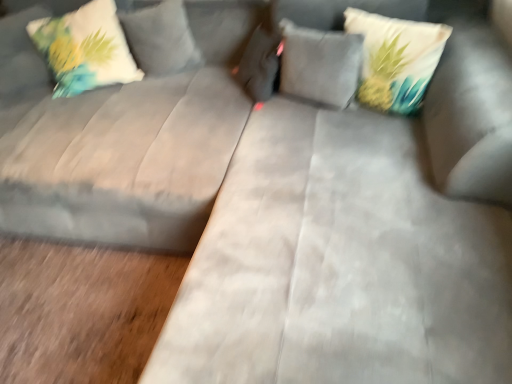
Identify the location of suede gray couch at center. The height and width of the screenshot is (384, 512). (113, 152).

Identify the location of suede gray pillow at center, the second pillow from the left. This screenshot has height=384, width=512. (320, 64).

What are the coordinates of `printed fabric pillow at upper right, which is the 1th pillow in right-to-left order` in the screenshot? It's located at (396, 59).

Where is `white fabric pillow with floral design at upper left, positioned as the third pillow in right-to-left order`? This screenshot has width=512, height=384. white fabric pillow with floral design at upper left, positioned as the third pillow in right-to-left order is located at coordinates (85, 48).

Can you confirm if suede gray couch at center is wider than white fabric pillow with floral design at upper left, the 1th pillow positioned from the left?

Yes, suede gray couch at center is wider than white fabric pillow with floral design at upper left, the 1th pillow positioned from the left.

Is suede gray couch at center touching white fabric pillow with floral design at upper left, the 1th pillow positioned from the left?

No, suede gray couch at center is not beside white fabric pillow with floral design at upper left, the 1th pillow positioned from the left.

Does point (47, 221) lie in front of point (61, 51)?

Yes, it is.

From the picture: From a real-world perspective, is suede gray couch at center beneath white fabric pillow with floral design at upper left, positioned as the third pillow in right-to-left order?

Yes, from a real-world perspective, suede gray couch at center is beneath white fabric pillow with floral design at upper left, positioned as the third pillow in right-to-left order.

Is white fabric pillow with floral design at upper left, the 1th pillow positioned from the left, facing towards printed fabric pillow at upper right, which is the 1th pillow in right-to-left order?

No, white fabric pillow with floral design at upper left, the 1th pillow positioned from the left, does not turn towards printed fabric pillow at upper right, which is the 1th pillow in right-to-left order.

Which point is more forward, [111,68] or [374,97]?

Positioned in front is point [374,97].

Does white fabric pillow with floral design at upper left, positioned as the third pillow in right-to-left order, have a smaller size compared to printed fabric pillow at upper right, the third pillow in the left-to-right sequence?

Incorrect, white fabric pillow with floral design at upper left, positioned as the third pillow in right-to-left order, is not smaller in size than printed fabric pillow at upper right, the third pillow in the left-to-right sequence.

From a real-world perspective, is white fabric pillow with floral design at upper left, the 1th pillow positioned from the left, positioned under printed fabric pillow at upper right, which is the 1th pillow in right-to-left order, based on gravity?

No, from a real-world perspective, white fabric pillow with floral design at upper left, the 1th pillow positioned from the left, is not under printed fabric pillow at upper right, which is the 1th pillow in right-to-left order.

Which is closer, (x=93, y=71) or (x=217, y=107)?

The point (x=217, y=107) is more forward.

From their relative heights in the image, would you say white fabric pillow with floral design at upper left, positioned as the third pillow in right-to-left order, is taller or shorter than suede gray couch at center?

white fabric pillow with floral design at upper left, positioned as the third pillow in right-to-left order, is shorter than suede gray couch at center.

Is white fabric pillow with floral design at upper left, positioned as the third pillow in right-to-left order, completely or partially outside of suede gray couch at center?

Actually, white fabric pillow with floral design at upper left, positioned as the third pillow in right-to-left order, is at least partially inside suede gray couch at center.

Can you tell me how much white fabric pillow with floral design at upper left, positioned as the third pillow in right-to-left order, and suede gray couch at center differ in facing direction?

0.000248 degrees.

Based on the photo, from a real-world perspective, between printed fabric pillow at upper right, which is the 1th pillow in right-to-left order, and suede gray couch at center, who is vertically higher?

printed fabric pillow at upper right, which is the 1th pillow in right-to-left order, from a real-world perspective.

Which of these two, printed fabric pillow at upper right, the third pillow in the left-to-right sequence, or suede gray couch at center, is bigger?

With larger size is suede gray couch at center.

Is printed fabric pillow at upper right, which is the 1th pillow in right-to-left order, next to suede gray couch at center?

No, printed fabric pillow at upper right, which is the 1th pillow in right-to-left order, is not touching suede gray couch at center.

Is printed fabric pillow at upper right, the third pillow in the left-to-right sequence, aimed at suede gray couch at center?

No, printed fabric pillow at upper right, the third pillow in the left-to-right sequence, is not facing towards suede gray couch at center.

Can suede gray pillow at center, which ranks as the 2th pillow in right-to-left order, be found inside printed fabric pillow at upper right, which is the 1th pillow in right-to-left order?

No.

From a real-world perspective, which is physically below, printed fabric pillow at upper right, the third pillow in the left-to-right sequence, or suede gray pillow at center, which ranks as the 2th pillow in right-to-left order?

From a 3D spatial view, suede gray pillow at center, which ranks as the 2th pillow in right-to-left order, is below.

Considering the relative sizes of printed fabric pillow at upper right, which is the 1th pillow in right-to-left order, and suede gray pillow at center, the second pillow from the left, in the image provided, is printed fabric pillow at upper right, which is the 1th pillow in right-to-left order, smaller than suede gray pillow at center, the second pillow from the left,?

No, printed fabric pillow at upper right, which is the 1th pillow in right-to-left order, is not smaller than suede gray pillow at center, the second pillow from the left.

Looking at their sizes, would you say printed fabric pillow at upper right, the third pillow in the left-to-right sequence, is wider or thinner than suede gray pillow at center, the second pillow from the left?

Considering their sizes, printed fabric pillow at upper right, the third pillow in the left-to-right sequence, looks broader than suede gray pillow at center, the second pillow from the left.

Considering the relative sizes of suede gray couch at center and suede gray pillow at center, which ranks as the 2th pillow in right-to-left order, in the image provided, is suede gray couch at center wider than suede gray pillow at center, which ranks as the 2th pillow in right-to-left order,?

Yes.

Which point is more distant from viewer, (143, 188) or (304, 45)?

Point (304, 45)

Is suede gray couch at center aimed at suede gray pillow at center, the second pillow from the left?

No, suede gray couch at center is not oriented towards suede gray pillow at center, the second pillow from the left.

From the image's perspective, is suede gray couch at center below suede gray pillow at center, which ranks as the 2th pillow in right-to-left order?

Correct, suede gray couch at center appears lower than suede gray pillow at center, which ranks as the 2th pillow in right-to-left order, in the image.

Is suede gray couch at center next to printed fabric pillow at upper right, the third pillow in the left-to-right sequence, and touching it?

No.

Which of these two, suede gray couch at center or printed fabric pillow at upper right, the third pillow in the left-to-right sequence, stands taller?

suede gray couch at center is taller.

From the image's perspective, is suede gray couch at center on top of printed fabric pillow at upper right, which is the 1th pillow in right-to-left order?

No, from the image's perspective, suede gray couch at center is not on top of printed fabric pillow at upper right, which is the 1th pillow in right-to-left order.

This screenshot has width=512, height=384. What are the coordinates of `couch in front of the white fabric pillow with floral design at upper left, positioned as the third pillow in right-to-left order` in the screenshot? It's located at pyautogui.click(x=113, y=152).

Identify the location of pillow that is the 2nd one when counting downward from the white fabric pillow with floral design at upper left, positioned as the third pillow in right-to-left order (from the image's perspective). (396, 59).

Considering their positions, is suede gray pillow at center, the second pillow from the left, positioned further to suede gray couch at center than printed fabric pillow at upper right, the third pillow in the left-to-right sequence?

printed fabric pillow at upper right, the third pillow in the left-to-right sequence, lies further to suede gray couch at center than the other object.

Which object lies nearer to the anchor point printed fabric pillow at upper right, which is the 1th pillow in right-to-left order, white fabric pillow with floral design at upper left, positioned as the third pillow in right-to-left order, or suede gray pillow at center, which ranks as the 2th pillow in right-to-left order?

suede gray pillow at center, which ranks as the 2th pillow in right-to-left order, lies closer to printed fabric pillow at upper right, which is the 1th pillow in right-to-left order, than the other object.

Based on their spatial positions, is suede gray pillow at center, which ranks as the 2th pillow in right-to-left order, or suede gray couch at center closer to white fabric pillow with floral design at upper left, positioned as the third pillow in right-to-left order?

suede gray couch at center.

Estimate the real-world distances between objects in this image. Which object is further from printed fabric pillow at upper right, which is the 1th pillow in right-to-left order, suede gray couch at center or suede gray pillow at center, the second pillow from the left?

Among the two, suede gray couch at center is located further to printed fabric pillow at upper right, which is the 1th pillow in right-to-left order.

Which object lies nearer to the anchor point suede gray pillow at center, which ranks as the 2th pillow in right-to-left order, white fabric pillow with floral design at upper left, the 1th pillow positioned from the left, or printed fabric pillow at upper right, which is the 1th pillow in right-to-left order?

The object closer to suede gray pillow at center, which ranks as the 2th pillow in right-to-left order, is printed fabric pillow at upper right, which is the 1th pillow in right-to-left order.

Considering their positions, is printed fabric pillow at upper right, the third pillow in the left-to-right sequence, positioned closer to suede gray couch at center than suede gray pillow at center, the second pillow from the left?

suede gray pillow at center, the second pillow from the left, is closer to suede gray couch at center.

Based on their spatial positions, is white fabric pillow with floral design at upper left, the 1th pillow positioned from the left, or printed fabric pillow at upper right, the third pillow in the left-to-right sequence, closer to suede gray couch at center?

Based on the image, white fabric pillow with floral design at upper left, the 1th pillow positioned from the left, appears to be nearer to suede gray couch at center.

Looking at the image, which one is located further to suede gray couch at center, suede gray pillow at center, the second pillow from the left, or white fabric pillow with floral design at upper left, positioned as the third pillow in right-to-left order?

Based on the image, suede gray pillow at center, the second pillow from the left, appears to be further to suede gray couch at center.

In order to click on couch located between white fabric pillow with floral design at upper left, positioned as the third pillow in right-to-left order, and suede gray pillow at center, which ranks as the 2th pillow in right-to-left order, in the left-right direction in this screenshot , I will do `click(113, 152)`.

The image size is (512, 384). Identify the location of pillow situated between white fabric pillow with floral design at upper left, positioned as the third pillow in right-to-left order, and printed fabric pillow at upper right, which is the 1th pillow in right-to-left order, from left to right. (320, 64).

Find the location of a particular element. The image size is (512, 384). pillow between suede gray couch at center and printed fabric pillow at upper right, the third pillow in the left-to-right sequence, from left to right is located at coordinates (320, 64).

Locate an element on the screen. Image resolution: width=512 pixels, height=384 pixels. couch located between white fabric pillow with floral design at upper left, the 1th pillow positioned from the left, and printed fabric pillow at upper right, the third pillow in the left-to-right sequence, in the left-right direction is located at coordinates (113, 152).